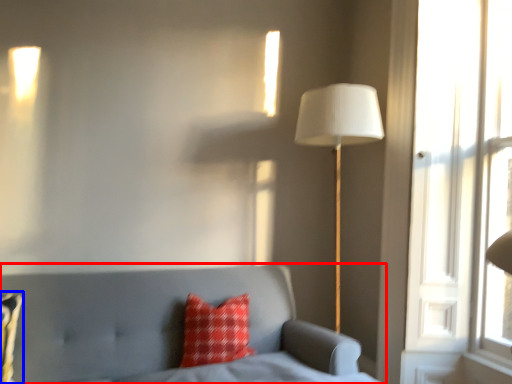
Question: Which point is closer to the camera, furniture (highlighted by a red box) or pillow (highlighted by a blue box)?

Choices:
 (A) furniture
 (B) pillow

Answer: (A)